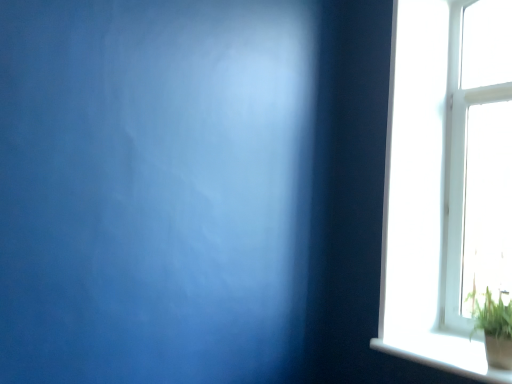
Question: Considering the relative sizes of white glossy window sill at lower right and green leafy plant at bottom right in the image provided, is white glossy window sill at lower right bigger than green leafy plant at bottom right?

Choices:
 (A) no
 (B) yes

Answer: (A)

Question: Can you confirm if white glossy window sill at lower right is smaller than green leafy plant at bottom right?

Choices:
 (A) no
 (B) yes

Answer: (B)

Question: From a real-world perspective, is white glossy window sill at lower right located beneath green leafy plant at bottom right?

Choices:
 (A) no
 (B) yes

Answer: (B)

Question: Is white glossy window sill at lower right looking in the opposite direction of green leafy plant at bottom right?

Choices:
 (A) no
 (B) yes

Answer: (A)

Question: Does white glossy window sill at lower right have a lesser width compared to green leafy plant at bottom right?

Choices:
 (A) yes
 (B) no

Answer: (B)

Question: From a real-world perspective, is white glossy window sill at lower right physically above green leafy plant at bottom right?

Choices:
 (A) yes
 (B) no

Answer: (B)

Question: Is green leafy plant at bottom right far from white glossy window sill at lower right?

Choices:
 (A) no
 (B) yes

Answer: (A)

Question: Is green leafy plant at bottom right wider than white glossy window sill at lower right?

Choices:
 (A) yes
 (B) no

Answer: (B)

Question: From a real-world perspective, is green leafy plant at bottom right physically above white glossy window sill at lower right?

Choices:
 (A) no
 (B) yes

Answer: (B)

Question: Is green leafy plant at bottom right thinner than white glossy window sill at lower right?

Choices:
 (A) yes
 (B) no

Answer: (A)

Question: Considering the relative sizes of green leafy plant at bottom right and white glossy window sill at lower right in the image provided, is green leafy plant at bottom right smaller than white glossy window sill at lower right?

Choices:
 (A) yes
 (B) no

Answer: (B)

Question: Can you confirm if green leafy plant at bottom right is shorter than white glossy window sill at lower right?

Choices:
 (A) yes
 (B) no

Answer: (B)

Question: Considering the positions of point (493, 365) and point (457, 344), is point (493, 365) closer or farther from the camera than point (457, 344)?

Choices:
 (A) closer
 (B) farther

Answer: (A)